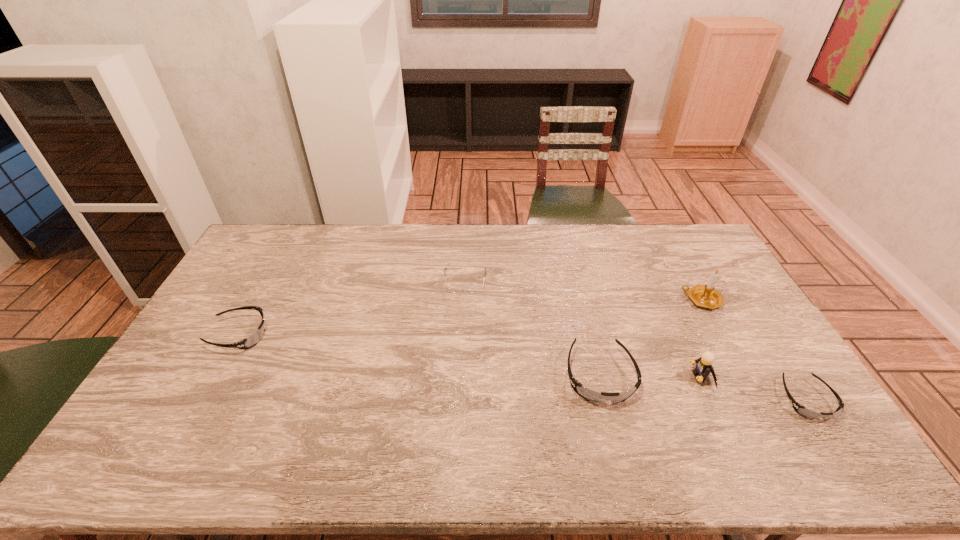
The height and width of the screenshot is (540, 960). Find the location of `candle holder situated at the right edge`. candle holder situated at the right edge is located at coordinates (706, 296).

Where is `object positioned at the near right corner`? This screenshot has height=540, width=960. object positioned at the near right corner is located at coordinates (801, 410).

Where is `vacant region at the far edge of the desktop`? vacant region at the far edge of the desktop is located at coordinates (407, 245).

Locate an element on the screen. vacant region at the near edge of the desktop is located at coordinates (716, 413).

Image resolution: width=960 pixels, height=540 pixels. In order to click on free space at the left edge in this screenshot , I will do `click(206, 313)`.

Find the location of a particular element. This screenshot has width=960, height=540. vacant space at the right edge of the desktop is located at coordinates (748, 349).

Image resolution: width=960 pixels, height=540 pixels. In order to click on free space at the far left corner of the desktop in this screenshot , I will do `click(281, 228)`.

You are a GUI agent. You are given a task and a screenshot of the screen. Output one action in this format:
    pyautogui.click(x=<x>, y=<y>)
    Task: Click on the free region at the near right corner of the desktop
    
    Given the screenshot: What is the action you would take?
    pyautogui.click(x=806, y=406)

Locate an element on the screen. vacant region between the fifth shortest object and the third object from left to right is located at coordinates (650, 376).

Identify the location of free space between the candle holder and the rightmost sunglasses. The image size is (960, 540). (754, 350).